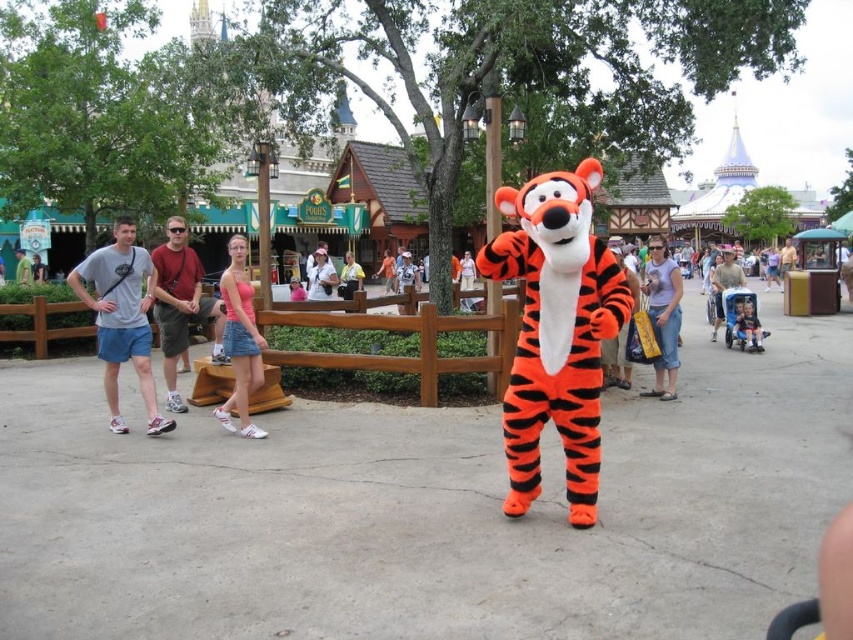
Question: Considering the relative positions of orange plush tiger at center and denim shorts at center in the image provided, where is orange plush tiger at center located with respect to denim shorts at center?

Choices:
 (A) above
 (B) below

Answer: (B)

Question: Which object is closer to the camera taking this photo?

Choices:
 (A) orange plush tiger at center
 (B) matte gray t-shirt at left
 (C) denim shorts at center
 (D) pink denim shorts at center

Answer: (A)

Question: Considering the relative positions of orange plush tiger at center and pink fabric dress at center in the image provided, where is orange plush tiger at center located with respect to pink fabric dress at center?

Choices:
 (A) right
 (B) left

Answer: (A)

Question: Which object appears closest to the camera in this image?

Choices:
 (A) orange plush tiger at center
 (B) denim shorts at center

Answer: (A)

Question: Based on their relative distances, which object is nearer to the yellow fabric shirt at center?

Choices:
 (A) matte gray t-shirt at left
 (B) matte gray shirt at left

Answer: (B)

Question: Can you confirm if pink denim shorts at center is positioned to the right of yellow fabric shirt at center?

Choices:
 (A) no
 (B) yes

Answer: (A)